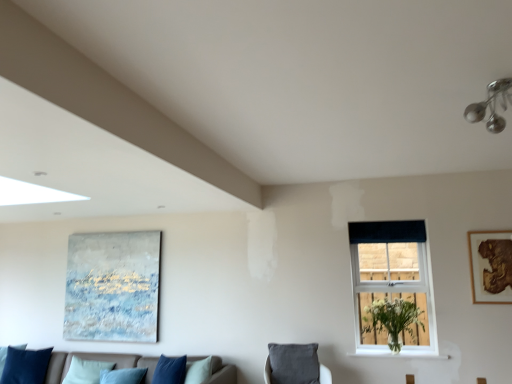
Question: Can you confirm if velvet blue pillow at lower left is positioned to the right of white plastic window at center?

Choices:
 (A) no
 (B) yes

Answer: (A)

Question: Can you confirm if velvet blue pillow at lower left is shorter than white plastic window at center?

Choices:
 (A) no
 (B) yes

Answer: (B)

Question: From a real-world perspective, is velvet blue pillow at lower left over white plastic window at center?

Choices:
 (A) no
 (B) yes

Answer: (A)

Question: Is velvet blue pillow at lower left looking in the opposite direction of white plastic window at center?

Choices:
 (A) no
 (B) yes

Answer: (A)

Question: Is velvet blue pillow at lower left not close to white plastic window at center?

Choices:
 (A) no
 (B) yes

Answer: (B)

Question: Considering the relative sizes of velvet blue pillow at lower left and white plastic window at center in the image provided, is velvet blue pillow at lower left smaller than white plastic window at center?

Choices:
 (A) yes
 (B) no

Answer: (B)

Question: Can you confirm if velvet blue pillow at lower left is wider than velvet grey cushion at lower center?

Choices:
 (A) no
 (B) yes

Answer: (B)

Question: From the image's perspective, is velvet blue pillow at lower left on velvet grey cushion at lower center?

Choices:
 (A) yes
 (B) no

Answer: (B)

Question: From a real-world perspective, is velvet blue pillow at lower left physically above velvet grey cushion at lower center?

Choices:
 (A) yes
 (B) no

Answer: (B)

Question: Does velvet blue pillow at lower left have a smaller size compared to velvet grey cushion at lower center?

Choices:
 (A) yes
 (B) no

Answer: (B)

Question: Considering the relative sizes of velvet blue pillow at lower left and velvet grey cushion at lower center in the image provided, is velvet blue pillow at lower left shorter than velvet grey cushion at lower center?

Choices:
 (A) no
 (B) yes

Answer: (A)

Question: Is velvet blue pillow at lower left positioned before velvet grey cushion at lower center?

Choices:
 (A) no
 (B) yes

Answer: (A)

Question: Is dark blue fabric at upper right taller than white matte vase at window?

Choices:
 (A) no
 (B) yes

Answer: (A)